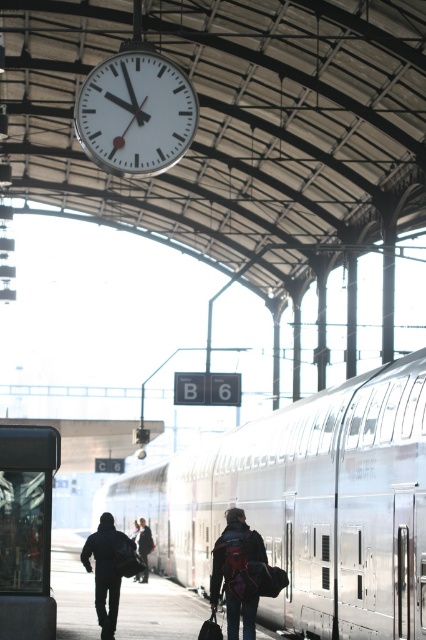
Question: Based on their relative distances, which object is farther from the dark blue jacket at center?

Choices:
 (A) silver metallic train at center
 (B) dark blue backpack at center
 (C) white metallic clock at upper center
 (D) matte black backpack at center

Answer: (A)

Question: Is matte black backpack at center positioned before dark blue jacket at center?

Choices:
 (A) no
 (B) yes

Answer: (B)

Question: Among these points, which one is nearest to the camera?

Choices:
 (A) (146, 541)
 (B) (236, 605)

Answer: (B)

Question: Which is nearer to the white metallic clock at upper center?

Choices:
 (A) dark blue jacket at center
 (B) silver metallic train at center
 (C) dark blue backpack at center

Answer: (A)

Question: Does matte black backpack at center have a smaller size compared to dark blue backpack at center?

Choices:
 (A) yes
 (B) no

Answer: (A)

Question: Is white metallic clock at upper center to the right of matte black backpack at center from the viewer's perspective?

Choices:
 (A) yes
 (B) no

Answer: (B)